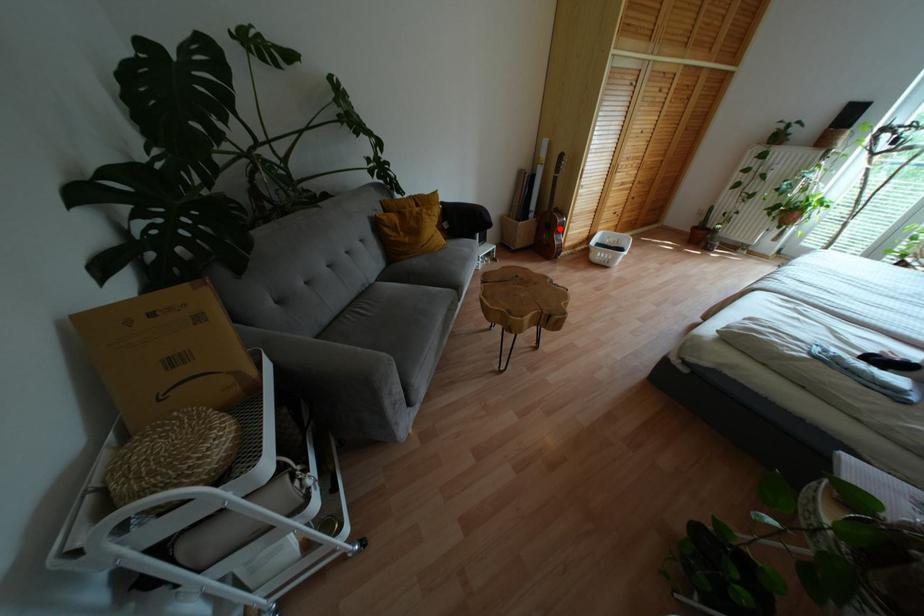
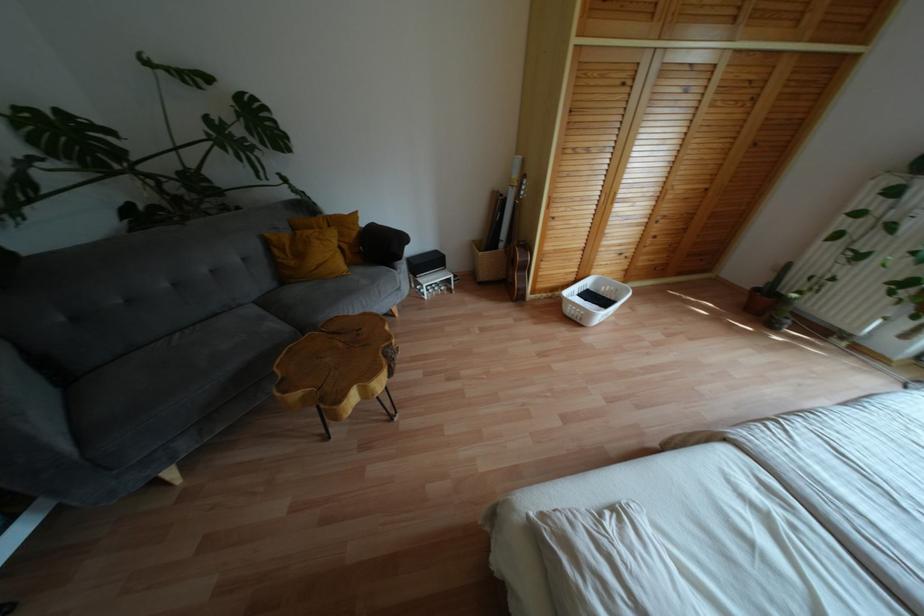
Question: I am providing you with two images of the same scene from different viewpoints. Given a red point in image1, look at the same physical point in image2. Is it:

Choices:
 (A) Closer to the viewpoint
 (B) Farther from the viewpoint

Answer: (B)